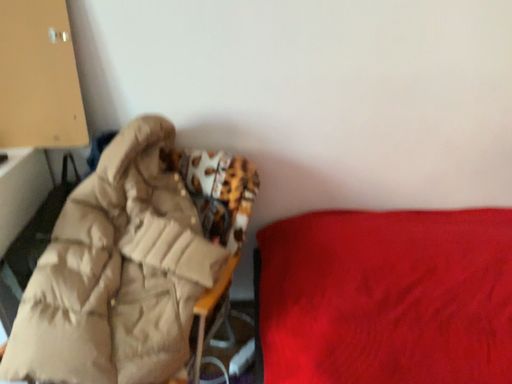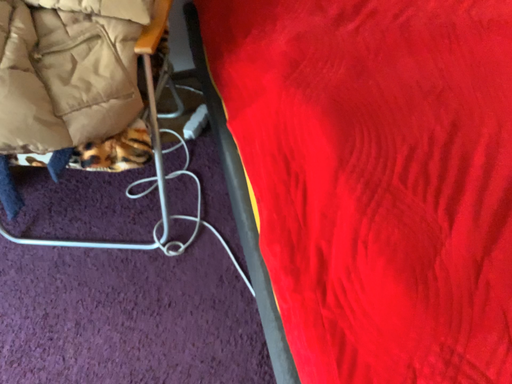
Question: Which way did the camera rotate in the video?

Choices:
 (A) rotated downward
 (B) rotated upward

Answer: (A)